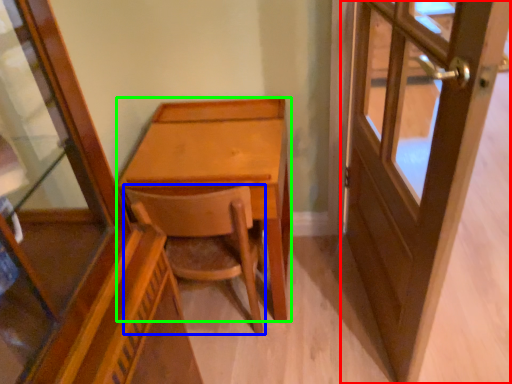
Question: Which is farther away from door (highlighted by a red box)? chair (highlighted by a blue box) or desk (highlighted by a green box)?

Choices:
 (A) chair
 (B) desk

Answer: (A)